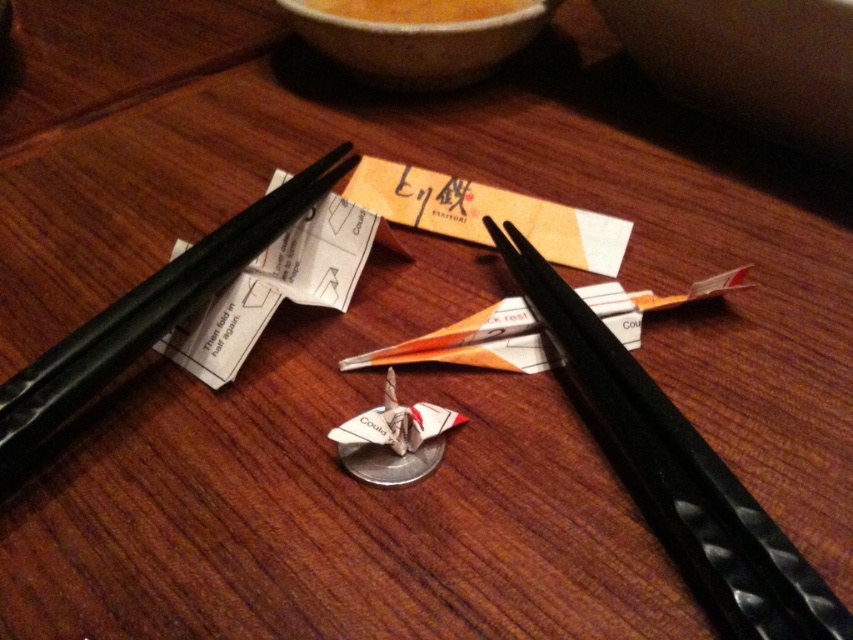
You are a guest at a dinner and want to reach for the matte ceramic bowl at upper center and the orange matte bowl at upper center. Which bowl can you reach first without moving your chair?

The matte ceramic bowl at upper center is closer to the viewer than the orange matte bowl at upper center, so you can reach it first without moving your chair.

You are organizing items on a wooden table. You need to place a new item between the black textured chopsticks at center and the matte brown bowl at upper center. Based on their positions, which object should the new item be closer to?

The new item should be placed closer to the matte brown bowl at upper center because the black textured chopsticks at center is to the left of the matte brown bowl at upper center, meaning the bowl is on the right side relative to the chopsticks. Therefore, placing the new item between them would require positioning it closer to the bowl to maintain the spatial arrangement.

Looking at this image, you are organizing the items on the table and need to place a new item between the black textured chopsticks at center and the matte brown bowl at upper center. Based on their positions, where should you position the new item?

The black textured chopsticks at center are in front of the matte brown bowl at upper center, so to place the new item between them, you should position it closer to the chopsticks but still behind them, maintaining the spatial relationship.